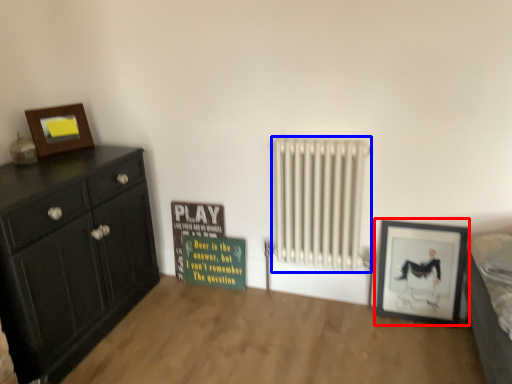
Question: Which of the following is the closest to the observer, picture frame (highlighted by a red box) or radiator (highlighted by a blue box)?

Choices:
 (A) picture frame
 (B) radiator

Answer: (B)